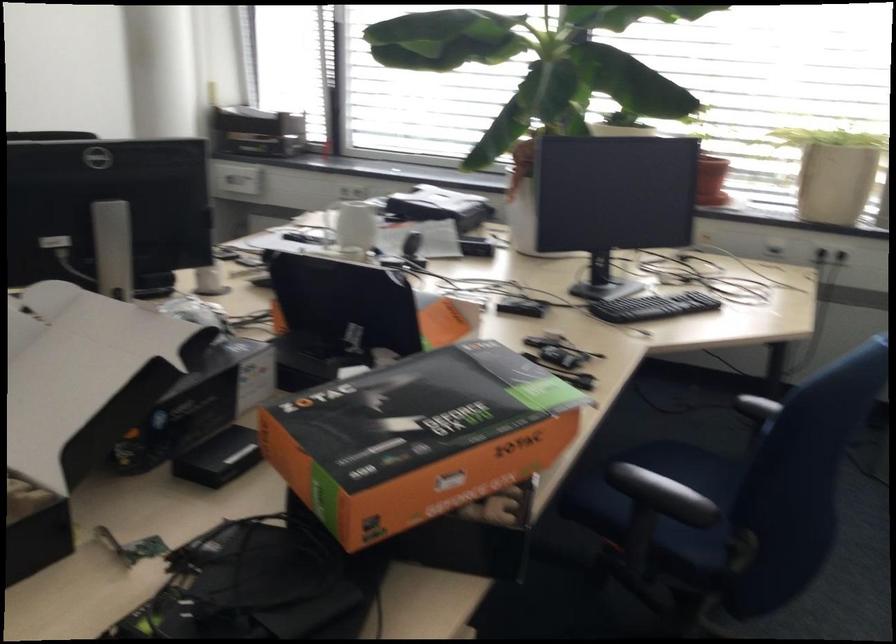
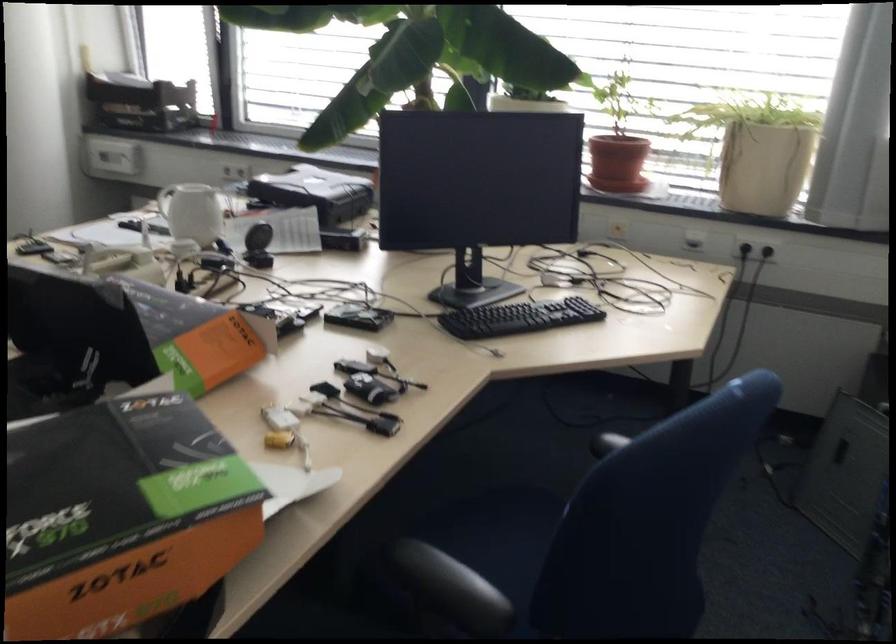
The point at [369,299] is marked in the first image. Where is the corresponding point in the second image?

(108, 326)